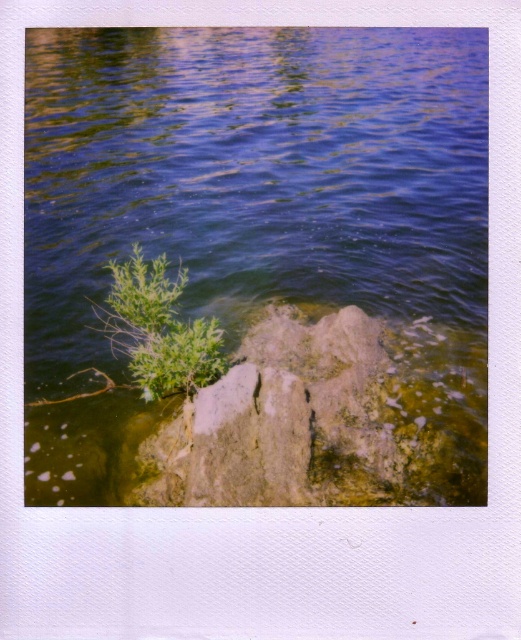
Question: Can you confirm if blue water at center is positioned to the left of green leafy plant at upper left?

Choices:
 (A) no
 (B) yes

Answer: (A)

Question: Which of the following is the closest to the observer?

Choices:
 (A) blue water at center
 (B) green leafy plant at upper left

Answer: (A)

Question: Is blue water at center bigger than green leafy plant at upper left?

Choices:
 (A) no
 (B) yes

Answer: (B)

Question: Is blue water at center thinner than green leafy plant at upper left?

Choices:
 (A) no
 (B) yes

Answer: (A)